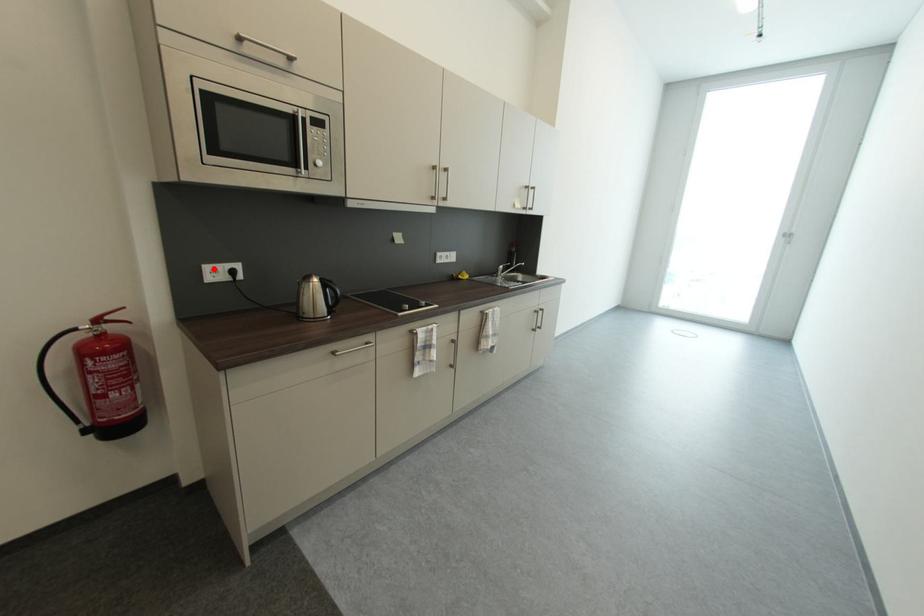
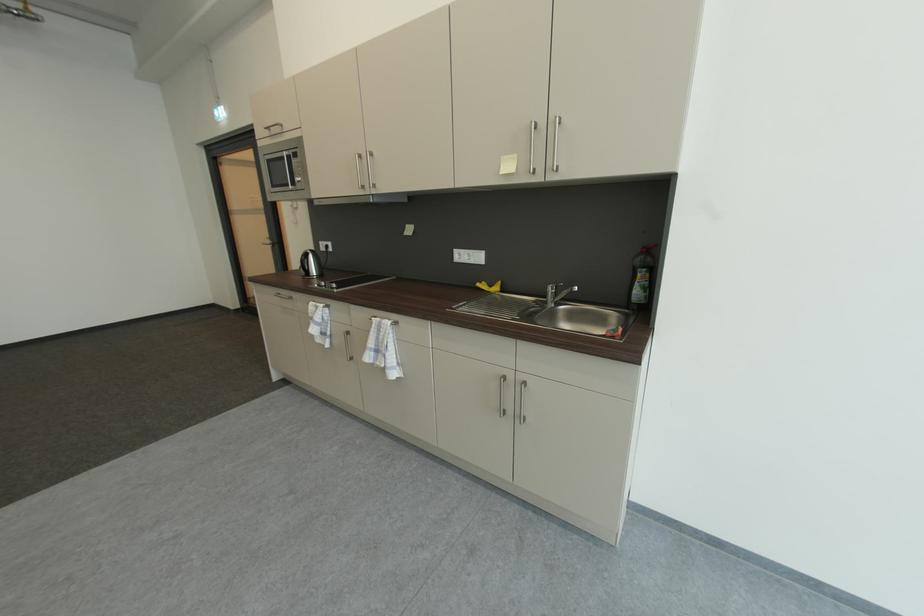
Question: I am providing you with two images of the same scene from different viewpoints. A red point is marked on the first image. Is the red point's position out of view in image 2?

Choices:
 (A) Yes
 (B) No

Answer: (B)